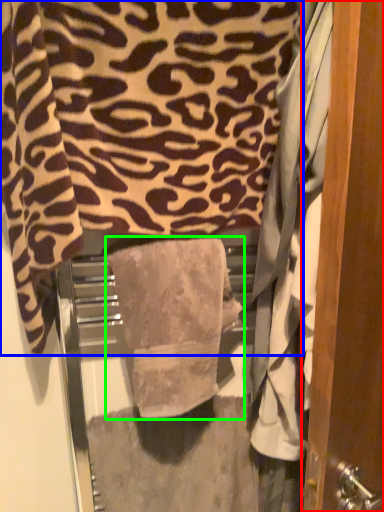
Question: Based on their relative distances, which object is farther from door (highlighted by a red box)? Choose from towel (highlighted by a blue box) and towel (highlighted by a green box).

Choices:
 (A) towel
 (B) towel

Answer: (A)